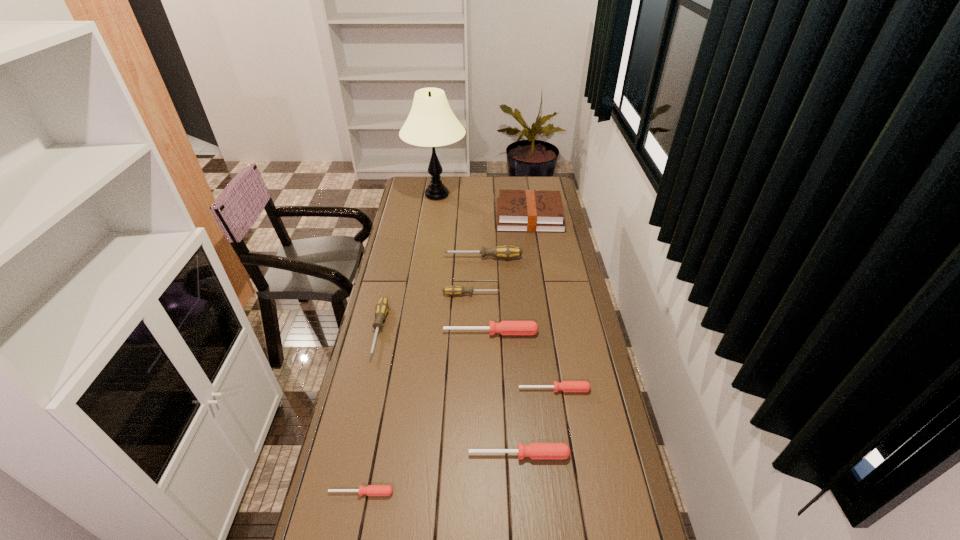
The image size is (960, 540). In order to click on free space located 0.110m at the tip of the farthest gray screwdriver in this screenshot , I will do `click(420, 258)`.

Find the location of a particular element. Image resolution: width=960 pixels, height=540 pixels. vacant space located 0.320m at the tip of the leftmost gray screwdriver is located at coordinates (352, 447).

Locate an element on the screen. free location located 0.100m on the right of the farthest red screwdriver is located at coordinates (564, 333).

Locate an element on the screen. vacant area situated at the tip of the second farthest screwdriver is located at coordinates (570, 294).

Identify the location of vacant space located on the left of the second nearest screwdriver. point(348,455).

You are a GUI agent. You are given a task and a screenshot of the screen. Output one action in this format:
    pyautogui.click(x=<x>, y=<y>)
    Task: Click on the vacant space situated 0.130m on the back of the third nearest screwdriver
    
    Given the screenshot: What is the action you would take?
    pyautogui.click(x=549, y=355)

You are a GUI agent. You are given a task and a screenshot of the screen. Output one action in this format:
    pyautogui.click(x=<x>, y=<y>)
    Task: Click on the vacant space located 0.160m on the right of the smallest red screwdriver
    
    Given the screenshot: What is the action you would take?
    pyautogui.click(x=451, y=492)

Where is `object that is at the far edge`? object that is at the far edge is located at coordinates (431, 123).

Find the location of `lamp positioned at the left edge`. lamp positioned at the left edge is located at coordinates (431, 123).

Locate an element on the screen. The height and width of the screenshot is (540, 960). hardback book that is at the right edge is located at coordinates (517, 210).